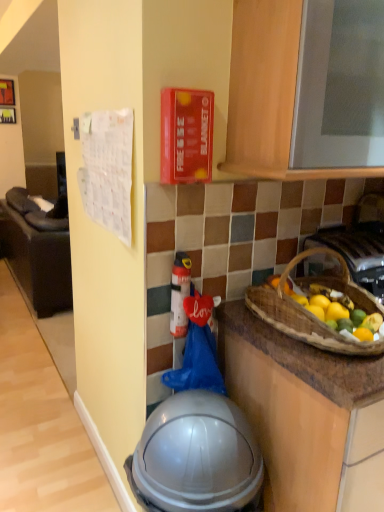
You are a GUI agent. You are given a task and a screenshot of the screen. Output one action in this format:
    pyautogui.click(x=<x>, y=<y>)
    Task: Click on the free space above metallic silver gas stove at right (from a real-world perspective)
    The image size is (384, 512).
    Given the screenshot: What is the action you would take?
    click(350, 234)